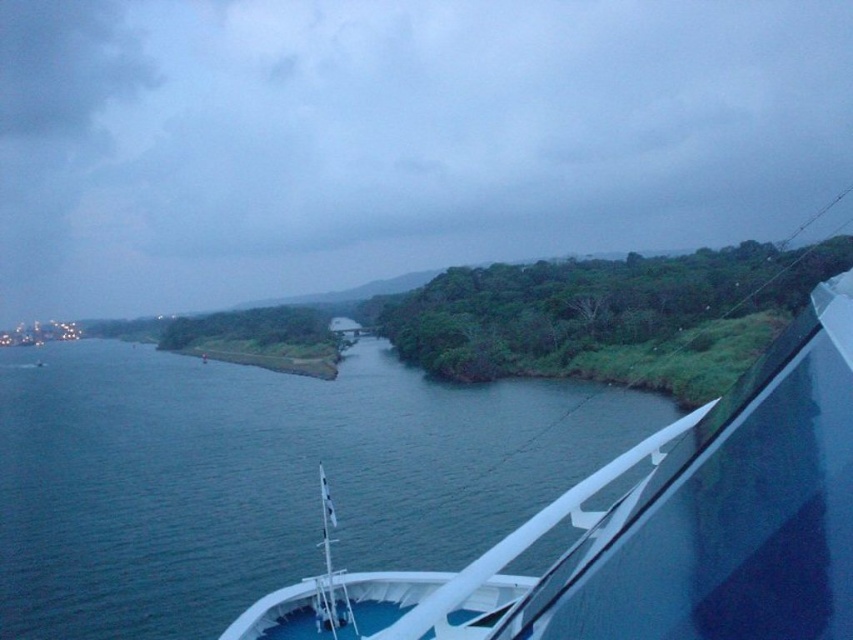
Is point (477, 552) less distant than point (728, 448)?

No, it is behind (728, 448).

From the picture: Is blue water at lower left positioned before white glossy boat at center?

No, blue water at lower left is behind white glossy boat at center.

You are a GUI agent. You are given a task and a screenshot of the screen. Output one action in this format:
    pyautogui.click(x=<x>, y=<y>)
    Task: Click on the blue water at lower left
    The height and width of the screenshot is (640, 853).
    Given the screenshot: What is the action you would take?
    pyautogui.click(x=260, y=477)